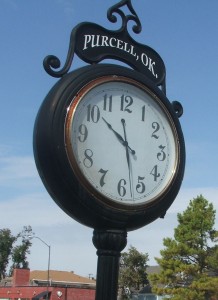
At what (x,y) coordinates should I click in order to perform the action: click on location of clock. Please return your answer as a coordinate pair (x, y). The height and width of the screenshot is (300, 218). Looking at the image, I should click on (114, 41), (149, 60).